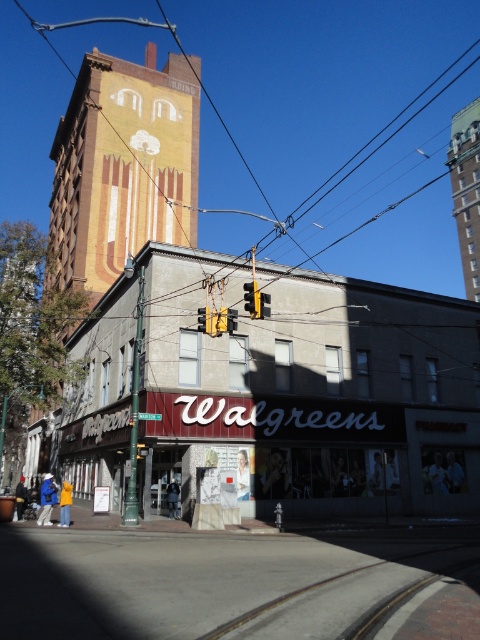
You are a pedestrian standing at the street corner and want to cross the road. You see the yellow metal train track at lower center and the yellow plastic traffic light at upper center. Which object is located to the right of the other?

The yellow metal train track at lower center is positioned on the right side of yellow plastic traffic light at upper center.

Based on the photo, you are a city planner assessing the street layout. The brown brick tower at upper center and the yellow plastic traffic light at center are both present. Which structure has a greater height?

The brown brick tower at upper center is taller than the yellow plastic traffic light at center.

You are a photographer planning to take a photo of the Walgreens pharmacy store. You notice the brown brick tower at upper center and the yellow plastic traffic light at upper center in the background. Which object should you adjust your camera focus to ensure it captures the larger one in the frame?

The brown brick tower at upper center is larger than the yellow plastic traffic light at upper center, so you should focus on the brown brick tower at upper center to capture the larger object in the frame.